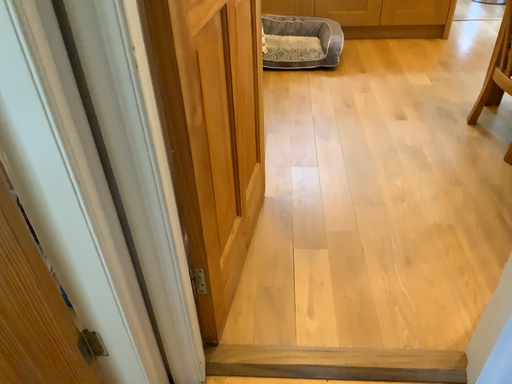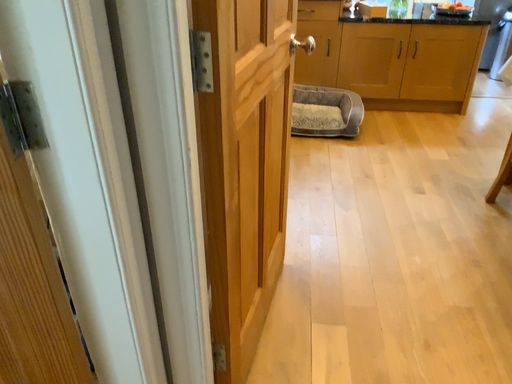
Question: Which way did the camera rotate in the video?

Choices:
 (A) rotated upward
 (B) rotated downward

Answer: (A)